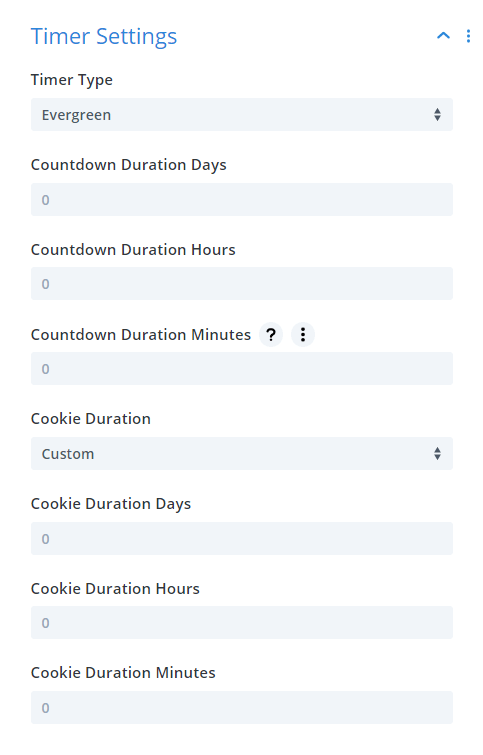
Locate an element on the screen. The height and width of the screenshot is (755, 483). timer is located at coordinates (59, 35).